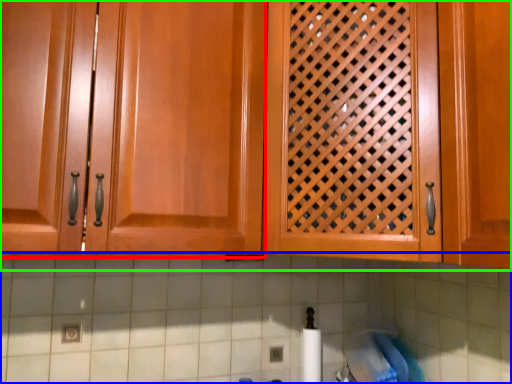
Question: Estimate the real-world distances between objects in this image. Which object is farther from cabinetry (highlighted by a red box), granite (highlighted by a blue box) or cabinetry (highlighted by a green box)?

Choices:
 (A) granite
 (B) cabinetry

Answer: (A)